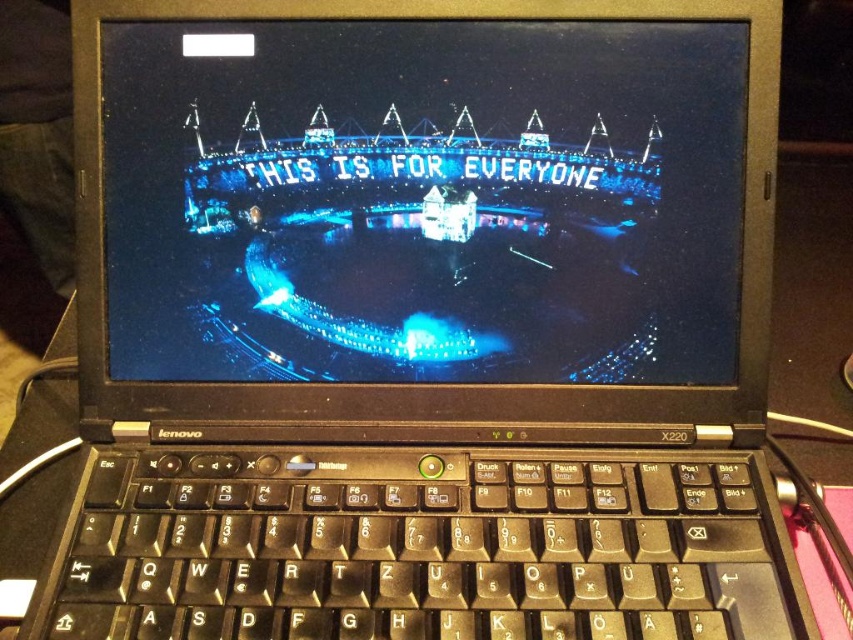
Based on the scene described, where exactly is the blue glossy screen at center located in terms of coordinates?

The blue glossy screen at center is located at point coordinates of [422,200].

You are trying to decide whether to place a decorative item between the blue glossy screen at center and the black plastic keyboard at center. Considering their heights, which object should the item be placed closer to in order to avoid blocking the view of the taller one?

The blue glossy screen at center is much taller than the black plastic keyboard at center, so the decorative item should be placed closer to the black plastic keyboard at center to avoid blocking the view of the taller screen.

You are a graphic designer working on a project and need to place a new element on the Lenovo X220 laptop screen. The screen has a coordinate system where the bottom left corner is the origin point. You want to place the element at the point with coordinates point (422, 200). Where exactly on the screen will this element be placed?

The point (422, 200) corresponds to the blue glossy screen at center, so placing the element there will position it at the center of the blue glossy screen.